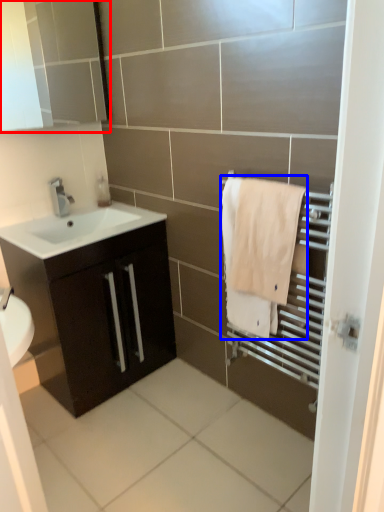
Question: Which object is closer to the camera taking this photo, medicine cabinet (highlighted by a red box) or bath towel (highlighted by a blue box)?

Choices:
 (A) medicine cabinet
 (B) bath towel

Answer: (B)